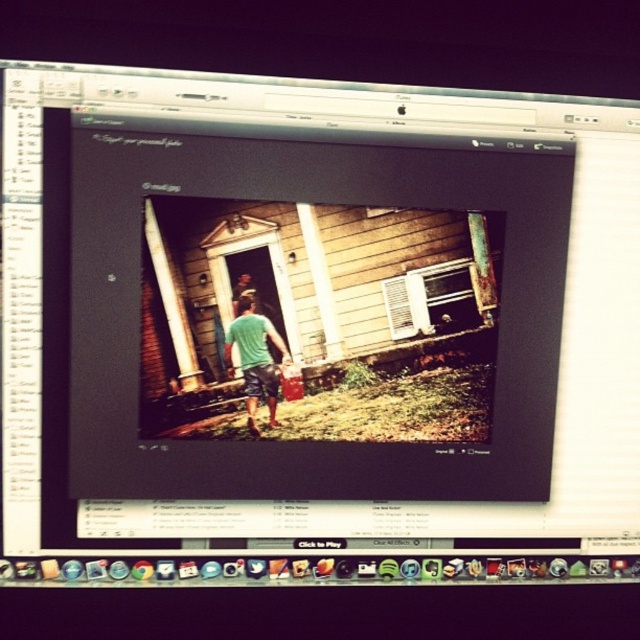
You are trying to edit a photo on your computer. You notice the matte black monitor at center and the green cotton shirt at center in the image. Which object is positioned higher on the screen?

The matte black monitor at center is above the green cotton shirt at center, so the matte black monitor at center is positioned higher on the screen.

You are using the photo editing software to adjust the depth of field. You want to focus on the person in the green shirt. The software allows you to set focus points by selecting coordinates. You have two points available to choose from, point A at coordinates point (328, 493) and point B at coordinates point (253, 400). Which point should you select to focus on the person in the green shirt?

Point A at coordinates point (328, 493) is closer to the camera than point B at coordinates point (253, 400). Therefore, to focus on the person in the green shirt, you should select point A at coordinates point (328, 493) since it is closer to the camera.

Consider the image. You are a photographer standing in front of the matte black monitor at center. You want to place your hand on the monitor to adjust the settings while also touching the green cotton shirt at center in the photo. Is your arm long enough to reach both at the same time if your arm span is 5 feet?

The distance between the matte black monitor at center and the green cotton shirt at center is 4.82 inches. Since 4.82 inches is much shorter than 5 feet, your arm span of 5 feet is more than sufficient to reach both the matte black monitor at center and the green cotton shirt at center simultaneously.